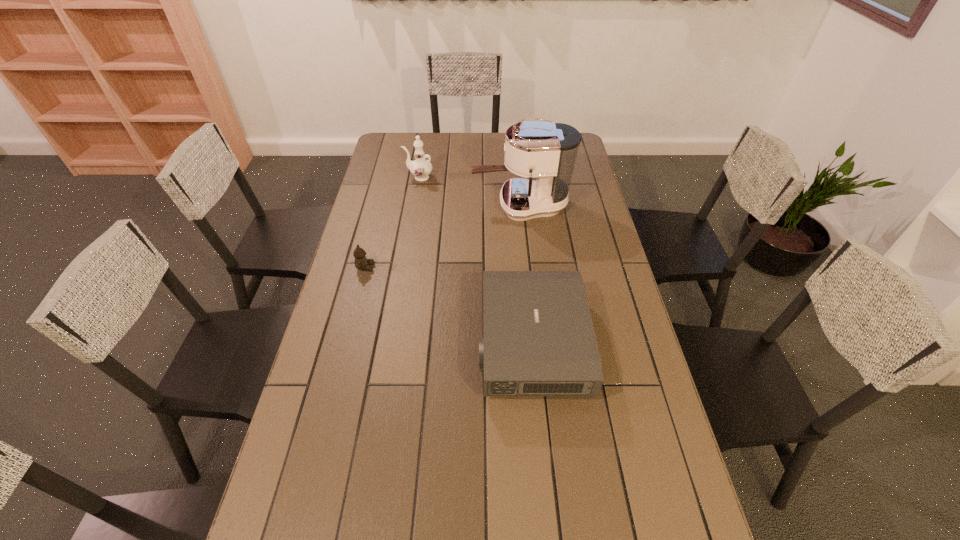
The image size is (960, 540). What are the coordinates of `the tallest object` in the screenshot? It's located at (547, 151).

Locate an element on the screen. coffee maker is located at coordinates (547, 151).

Identify the location of the farthest object. (421, 168).

This screenshot has width=960, height=540. Identify the location of chinaware. (421, 168).

At what (x,y) coordinates should I click in order to perform the action: click on the nearest object. Please return your answer as a coordinate pair (x, y). Looking at the image, I should click on (538, 339).

This screenshot has height=540, width=960. I want to click on projector, so click(538, 339).

This screenshot has width=960, height=540. I want to click on teddy bear, so click(361, 262).

Find the location of a particular element. the leftmost object is located at coordinates (361, 262).

Where is `vacant space located on the front-facing side of the third nearest object`? vacant space located on the front-facing side of the third nearest object is located at coordinates [377, 205].

Identify the location of free space located 0.300m on the front-facing side of the third nearest object. This screenshot has height=540, width=960. [396, 205].